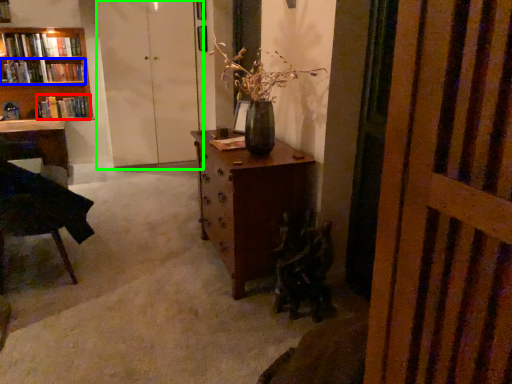
Question: Which object is positioned farthest from book (highlighted by a red box)? Select from book (highlighted by a blue box) and screen door (highlighted by a green box).

Choices:
 (A) book
 (B) screen door

Answer: (B)